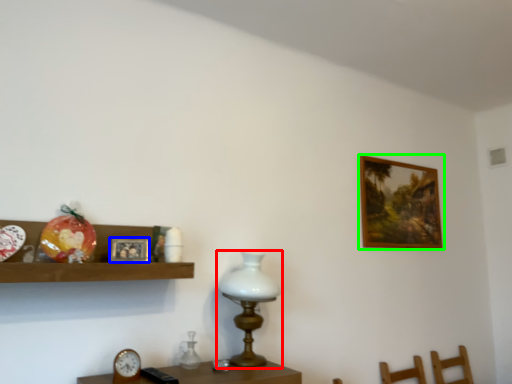
Question: Estimate the real-world distances between objects in this image. Which object is closer to table lamp (highlighted by a red box), picture frame (highlighted by a blue box) or picture frame (highlighted by a green box)?

Choices:
 (A) picture frame
 (B) picture frame

Answer: (A)